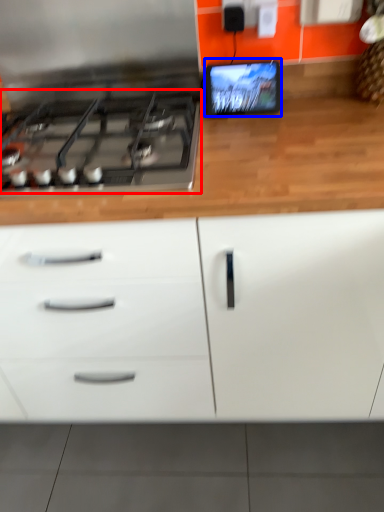
Question: Which point is closer to the camera, gas stove (highlighted by a red box) or computer monitor (highlighted by a blue box)?

Choices:
 (A) gas stove
 (B) computer monitor

Answer: (A)